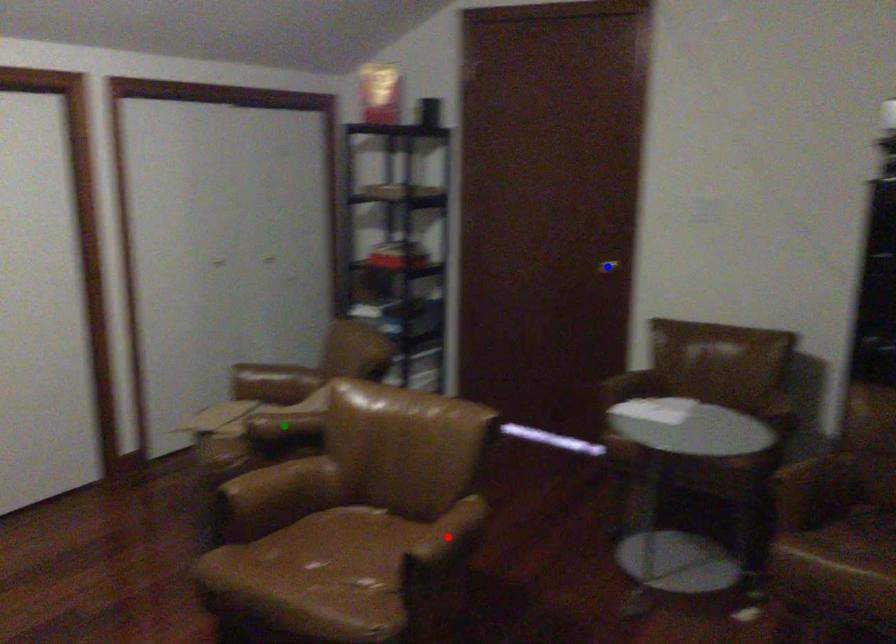
Order these from nearest to farthest:
blue point
green point
red point

blue point, green point, red point